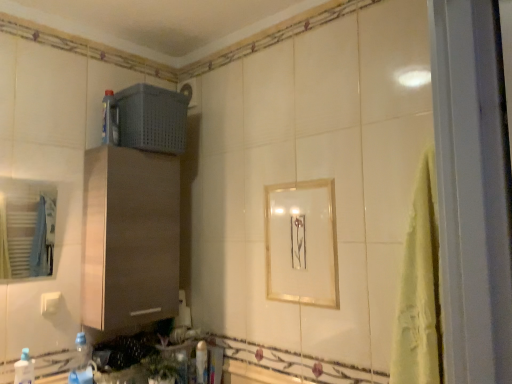
Question: Can you confirm if gold metallic picture frame at center is bigger than white glossy bath at lower center?

Choices:
 (A) no
 (B) yes

Answer: (B)

Question: From the image's perspective, does gold metallic picture frame at center appear lower than white glossy bath at lower center?

Choices:
 (A) no
 (B) yes

Answer: (A)

Question: Is gold metallic picture frame at center at the left side of white glossy bath at lower center?

Choices:
 (A) no
 (B) yes

Answer: (A)

Question: Is gold metallic picture frame at center aimed at white glossy bath at lower center?

Choices:
 (A) no
 (B) yes

Answer: (A)

Question: Is gold metallic picture frame at center positioned in front of white glossy bath at lower center?

Choices:
 (A) no
 (B) yes

Answer: (B)

Question: Is gold metallic picture frame at center beside white glossy bath at lower center?

Choices:
 (A) no
 (B) yes

Answer: (A)

Question: Does white glossy bottle at lower center, which is the first bottle in bottom-to-top order, come behind gray plastic basket at upper center?

Choices:
 (A) no
 (B) yes

Answer: (B)

Question: Is white glossy bottle at lower center, acting as the fourth bottle starting from the front, to the left of gray plastic basket at upper center from the viewer's perspective?

Choices:
 (A) no
 (B) yes

Answer: (A)

Question: Is white glossy bottle at lower center, the 4th bottle when ordered from left to right, thinner than gray plastic basket at upper center?

Choices:
 (A) no
 (B) yes

Answer: (B)

Question: Is white glossy bottle at lower center, acting as the fourth bottle starting from the front, in front of gray plastic basket at upper center?

Choices:
 (A) yes
 (B) no

Answer: (B)

Question: Is white glossy bottle at lower center, the fourth bottle when ordered from top to bottom, positioned with its back to gray plastic basket at upper center?

Choices:
 (A) yes
 (B) no

Answer: (B)

Question: Is white glossy bottle at lower center, acting as the fourth bottle starting from the front, outside of gray plastic basket at upper center?

Choices:
 (A) yes
 (B) no

Answer: (A)

Question: Is white glossy bath at lower center outside gray plastic basket at upper center?

Choices:
 (A) yes
 (B) no

Answer: (A)